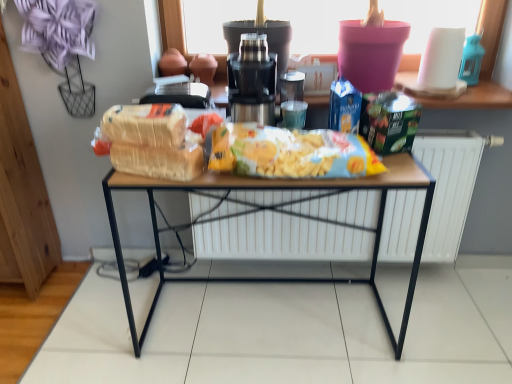
This screenshot has width=512, height=384. Identify the location of white matte radiator at center. (277, 240).

Describe the element at coordinates (277, 240) in the screenshot. This screenshot has height=384, width=512. I see `white matte radiator at center` at that location.

Find the location of a particular element. This screenshot has width=512, height=384. metallic silver coffee machine at center is located at coordinates (252, 81).

Looking at this image, what is the approximate width of wooden table at center?

It is 46.55 centimeters.

What is the approximate height of translucent plastic bag of cereal at center?

The height of translucent plastic bag of cereal at center is 4.81 inches.

The width and height of the screenshot is (512, 384). What are the coordinates of `bread at center` in the screenshot? It's located at click(150, 141).

Where is `white matte radiator at center`? The height and width of the screenshot is (384, 512). white matte radiator at center is located at coordinates (277, 240).

Which object is more forward, translucent plastic bag of cereal at center or bread at center?

translucent plastic bag of cereal at center is closer to the camera.

From a real-world perspective, between translucent plastic bag of cereal at center and bread at center, who is vertically lower?

From a 3D spatial view, bread at center is below.

Is translucent plastic bag of cereal at center in contact with bread at center?

Yes, translucent plastic bag of cereal at center is next to bread at center.

Does translucent plastic bag of cereal at center contain bread at center?

That's incorrect, bread at center is not inside translucent plastic bag of cereal at center.

Looking at the image, does metallic silver coffee machine at center seem bigger or smaller compared to wooden table at center?

Clearly, metallic silver coffee machine at center is smaller in size than wooden table at center.

Which of these two, metallic silver coffee machine at center or wooden table at center, is wider?

With larger width is wooden table at center.

Is wooden table at center a part of metallic silver coffee machine at center?

No, wooden table at center is located outside of metallic silver coffee machine at center.

From the picture: From a real-world perspective, between metallic silver coffee machine at center and wooden table at center, who is vertically higher?

metallic silver coffee machine at center.

Considering the relative positions of yellow matte chips at center and white matte radiator at center in the image provided, is yellow matte chips at center to the right of white matte radiator at center from the viewer's perspective?

No.

Is white matte radiator at center at the back of yellow matte chips at center?

No, white matte radiator at center is not at the back of yellow matte chips at center.

Is yellow matte chips at center bigger than white matte radiator at center?

Incorrect, yellow matte chips at center is not larger than white matte radiator at center.

Which object is thinner, wooden table at center or translucent plastic bag of cereal at center?

translucent plastic bag of cereal at center is thinner.

Based on the photo, how many degrees apart are the facing directions of wooden table at center and translucent plastic bag of cereal at center?

They differ by 17.6 degrees in their facing directions.

Is wooden table at center looking in the opposite direction of translucent plastic bag of cereal at center?

No, translucent plastic bag of cereal at center is not at the back of wooden table at center.

From the image's perspective, is wooden table at center over translucent plastic bag of cereal at center?

No.

From a real-world perspective, is yellow matte chips at center physically above translucent plastic bag of cereal at center?

No, from a real-world perspective, yellow matte chips at center is not over translucent plastic bag of cereal at center

Does yellow matte chips at center come behind translucent plastic bag of cereal at center?

Yes, yellow matte chips at center is behind translucent plastic bag of cereal at center.

From the picture: From the image's perspective, is yellow matte chips at center above or below translucent plastic bag of cereal at center?

Clearly, from the image's perspective, yellow matte chips at center is below translucent plastic bag of cereal at center.

Where is `food that appears behind the translucent plastic bag of cereal at center`? food that appears behind the translucent plastic bag of cereal at center is located at coordinates (291, 153).

Considering the points (106, 111) and (285, 152), which point is in front, point (106, 111) or point (285, 152)?

Point (285, 152)

Measure the distance from translucent plastic bag of cereal at center to yellow matte chips at center.

translucent plastic bag of cereal at center and yellow matte chips at center are 28.55 centimeters apart from each other.

Could you tell me if translucent plastic bag of cereal at center is facing yellow matte chips at center?

No, translucent plastic bag of cereal at center is not turned towards yellow matte chips at center.

From a real-world perspective, which object stands above the other?

In real-world perspective, translucent plastic bag of cereal at center is above.

Is white matte radiator at center in contact with wooden table at center?

No, white matte radiator at center is not beside wooden table at center.

Consider the image. Is white matte radiator at center inside the boundaries of wooden table at center, or outside?

white matte radiator at center is located beyond the bounds of wooden table at center.

Is white matte radiator at center positioned with its back to wooden table at center?

Absolutely, white matte radiator at center is directed away from wooden table at center.

Considering the sizes of objects white matte radiator at center and wooden table at center in the image provided, who is wider, white matte radiator at center or wooden table at center?

Wider between the two is wooden table at center.

I want to click on snack that appears on the left of translucent plastic bag of cereal at center, so click(150, 141).

Locate an element on the screen. The width and height of the screenshot is (512, 384). coffee machine that appears behind the wooden table at center is located at coordinates point(252,81).

Considering their positions, is yellow matte chips at center positioned closer to translucent plastic bag of cereal at center than wooden table at center?

yellow matte chips at center is closer to translucent plastic bag of cereal at center.

In the scene shown: When comparing their distances from yellow matte chips at center, does white matte radiator at center or bread at center seem closer?

Based on the image, bread at center appears to be nearer to yellow matte chips at center.

Estimate the real-world distances between objects in this image. Which object is closer to metallic silver coffee machine at center, bread at center or yellow matte chips at center?

yellow matte chips at center lies closer to metallic silver coffee machine at center than the other object.

Considering their positions, is white matte radiator at center positioned further to yellow matte chips at center than translucent plastic bag of cereal at center?

white matte radiator at center is positioned further to the anchor yellow matte chips at center.

When comparing their distances from bread at center, does metallic silver coffee machine at center or translucent plastic bag of cereal at center seem closer?

translucent plastic bag of cereal at center lies closer to bread at center than the other object.

When comparing their distances from metallic silver coffee machine at center, does white matte radiator at center or translucent plastic bag of cereal at center seem further?

white matte radiator at center.

Considering their positions, is yellow matte chips at center positioned further to metallic silver coffee machine at center than white matte radiator at center?

white matte radiator at center lies further to metallic silver coffee machine at center than the other object.

From the image, which object appears to be nearer to translucent plastic bag of cereal at center, wooden table at center or yellow matte chips at center?

yellow matte chips at center lies closer to translucent plastic bag of cereal at center than the other object.

Locate an element on the screen. snack between metallic silver coffee machine at center and wooden table at center in the up-down direction is located at coordinates (150, 141).

Identify the location of cereal between bread at center and white matte radiator at center from left to right. This screenshot has width=512, height=384. (145, 124).

You are a GUI agent. You are given a task and a screenshot of the screen. Output one action in this format:
    pyautogui.click(x=<x>, y=<y>)
    Task: Click on the cereal that lies between metallic silver coffee machine at center and wooden table at center from top to bottom
    
    Given the screenshot: What is the action you would take?
    [145, 124]

The height and width of the screenshot is (384, 512). Identify the location of coffee machine between translucent plastic bag of cereal at center and white matte radiator at center in the horizontal direction. (252, 81).